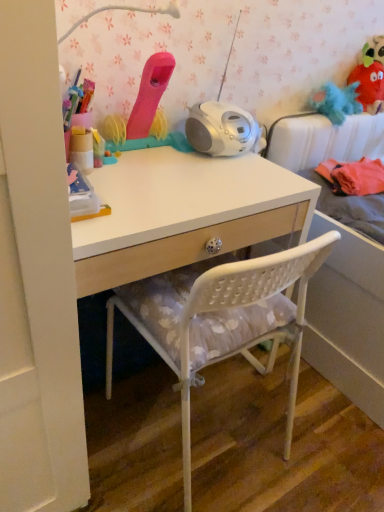
Find the location of a particular element. unoccupied region to the right of white plastic chair at center is located at coordinates (312, 435).